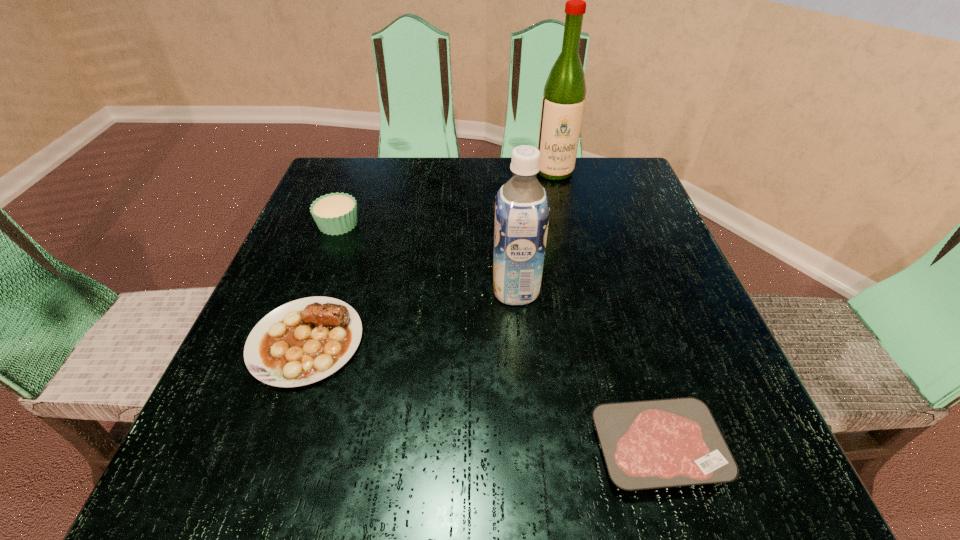
Image resolution: width=960 pixels, height=540 pixels. I want to click on free region located on the label of the farthest object, so click(x=576, y=263).

Locate an element on the screen. free space located on the label of the soya milk is located at coordinates (321, 290).

I want to click on vacant region located on the label of the soya milk, so click(x=299, y=290).

What are the coordinates of `free space located on the label of the soya milk` in the screenshot? It's located at (366, 290).

The image size is (960, 540). What are the coordinates of `blank space located 0.270m on the front of the cupcake` in the screenshot? It's located at (293, 343).

The height and width of the screenshot is (540, 960). What are the coordinates of `vacant point located on the back of the fourth tallest object` in the screenshot? It's located at (361, 186).

Locate an element on the screen. Image resolution: width=960 pixels, height=540 pixels. free space located 0.390m on the left of the right steak is located at coordinates (300, 448).

Where is `liquor located in the far edge section of the desktop`? The image size is (960, 540). liquor located in the far edge section of the desktop is located at coordinates (563, 101).

Find the location of `cupcake situated at the far edge`. cupcake situated at the far edge is located at coordinates (336, 213).

Locate an element on the screen. The width and height of the screenshot is (960, 540). object that is at the near edge is located at coordinates (649, 444).